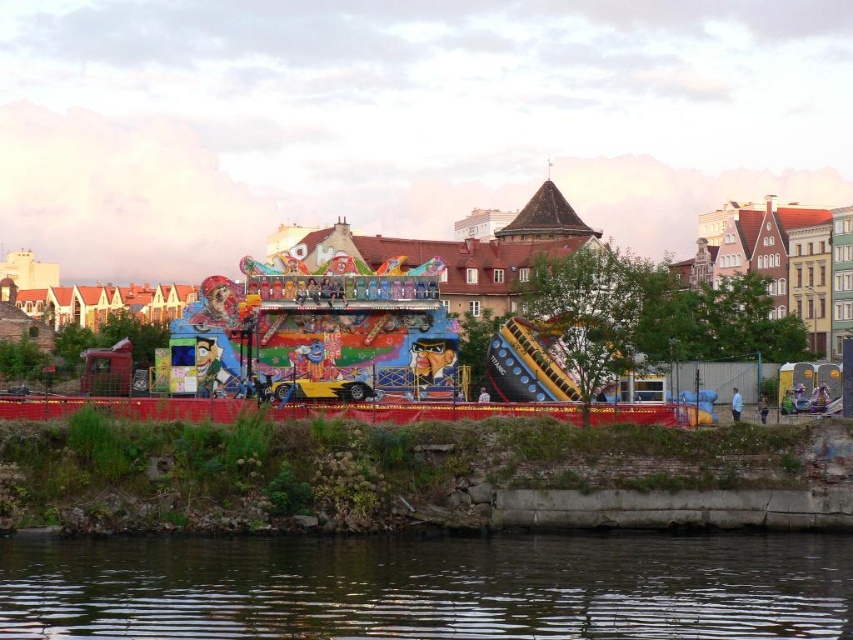
You are standing at the entrance of the amusement ride and want to cross from the dark brown water at lower center to the brick wall at lower center. Which path is wider?

The brick wall at lower center is wider than the dark brown water at lower center, so the path to the brick wall at lower center is wider.

You are a maintenance worker checking the amusement ride. You need to determine if the dark brown water at lower center is higher than the brick wall at lower center to assess potential flooding risks. Based on the scene, what is your assessment?

The dark brown water at lower center is shorter than the brick wall at lower center, so there is no immediate flooding risk as the water level is below the wall height.

You are a painter who wants to paint both the brick wall at lower center and the colorful painted ride at center. Which object requires more area to paint?

The colorful painted ride at center requires more area to paint because it occupies more space than the brick wall at lower center.